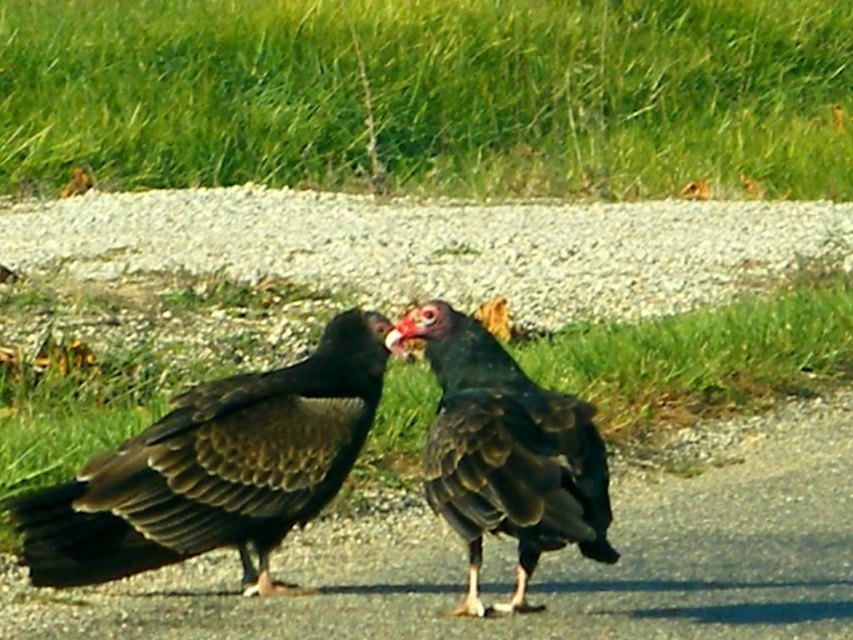
You are a photographer trying to capture a closeup of the matte black vulture at center. The camera you are using has a focal length of 100mm and requires a minimum distance of 2 meters to focus properly. You are currently standing at point (215, 468). Can you take the photo without moving closer than 2 meters?

The point (215, 468) marks the matte black vulture at center, so you are already at the location of the vulture. To take the photo without moving closer than 2 meters, you would need to be at least 2 meters away. Since you are at the same point as the vulture, you are too close to use the camera properly.

You are a wildlife photographer aiming to capture both the matte black vulture at center and the shiny black vulture at center in a single photo. Based on their positions, which vulture should you focus on first to ensure both are in frame?

The matte black vulture at center is located below the shiny black vulture at center. To ensure both are in frame, focus on the shiny black vulture at center first since it is higher up, allowing you to adjust the camera angle downward to include the lower one.